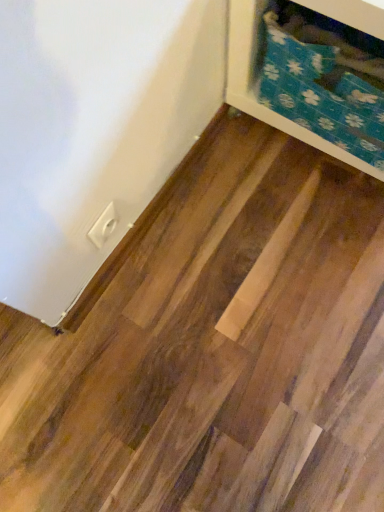
Question: Is white plastic outlet at lower left taller or shorter than blue floral fabric at upper right?

Choices:
 (A) short
 (B) tall

Answer: (A)

Question: From the image's perspective, is white plastic outlet at lower left located above or below blue floral fabric at upper right?

Choices:
 (A) below
 (B) above

Answer: (A)

Question: Is white plastic outlet at lower left in front of or behind blue floral fabric at upper right in the image?

Choices:
 (A) behind
 (B) front

Answer: (A)

Question: Would you say blue floral fabric at upper right is to the left or to the right of white plastic outlet at lower left in the picture?

Choices:
 (A) left
 (B) right

Answer: (B)

Question: Is point (370, 169) positioned closer to the camera than point (96, 238)?

Choices:
 (A) farther
 (B) closer

Answer: (A)

Question: Is blue floral fabric at upper right wider or thinner than white plastic outlet at lower left?

Choices:
 (A) thin
 (B) wide

Answer: (B)

Question: From a real-world perspective, relative to white plastic outlet at lower left, is blue floral fabric at upper right vertically above or below?

Choices:
 (A) above
 (B) below

Answer: (A)